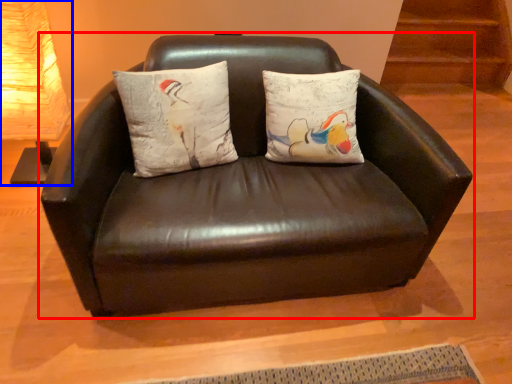
Question: Which object is further to the camera taking this photo, studio couch (highlighted by a red box) or table lamp (highlighted by a blue box)?

Choices:
 (A) studio couch
 (B) table lamp

Answer: (B)